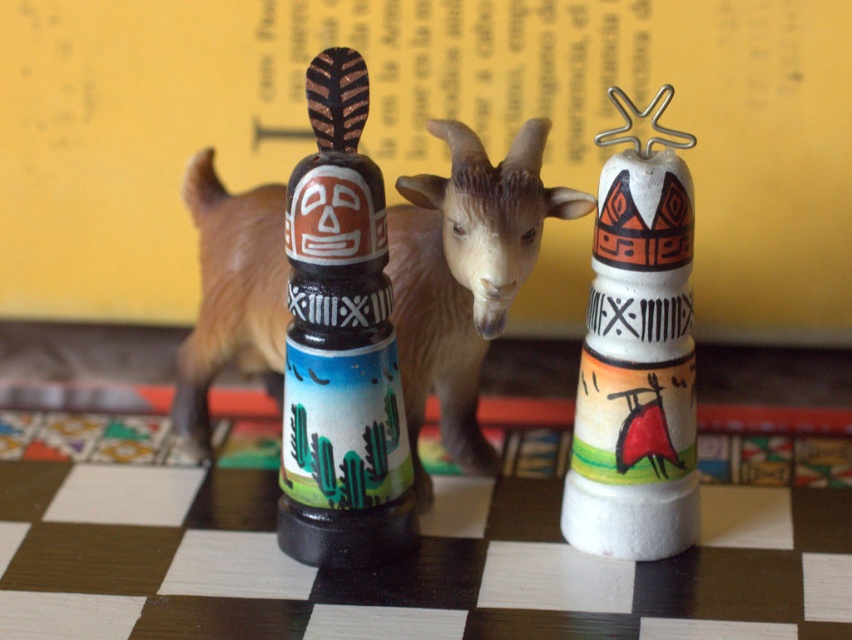
Which of these two, matte painted totem pole at center or white matte totem at right, stands shorter?

white matte totem at right

Who is positioned more to the right, matte painted totem pole at center or white matte totem at right?

white matte totem at right

This screenshot has width=852, height=640. What do you see at coordinates (340, 344) in the screenshot? I see `matte painted totem pole at center` at bounding box center [340, 344].

Locate an element on the screen. matte painted totem pole at center is located at coordinates (340, 344).

Measure the distance between brown plastic goat at center and matte painted totem pole at center.

brown plastic goat at center is 4.06 inches from matte painted totem pole at center.

Who is positioned more to the left, brown plastic goat at center or matte painted totem pole at center?

matte painted totem pole at center

Between point (407, 250) and point (371, 196), which one is positioned in front?

Point (371, 196) is in front.

Locate an element on the screen. The width and height of the screenshot is (852, 640). brown plastic goat at center is located at coordinates (464, 273).

Can you confirm if brown plastic goat at center is smaller than white matte totem at right?

Incorrect, brown plastic goat at center is not smaller in size than white matte totem at right.

Is brown plastic goat at center to the right of white matte totem at right from the viewer's perspective?

No, brown plastic goat at center is not to the right of white matte totem at right.

What do you see at coordinates (464, 273) in the screenshot? The width and height of the screenshot is (852, 640). I see `brown plastic goat at center` at bounding box center [464, 273].

Where is `brown plastic goat at center`? The image size is (852, 640). brown plastic goat at center is located at coordinates (464, 273).